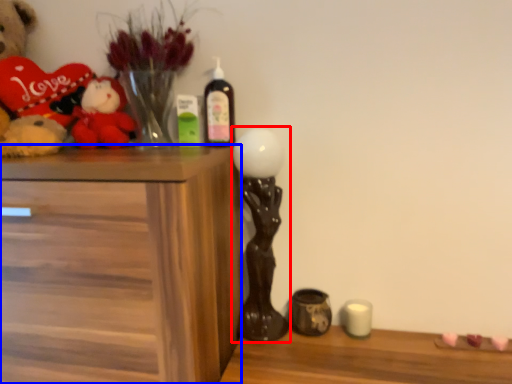
Question: Which point is further to the camera, candle holder (highlighted by a red box) or chest of drawers (highlighted by a blue box)?

Choices:
 (A) candle holder
 (B) chest of drawers

Answer: (A)